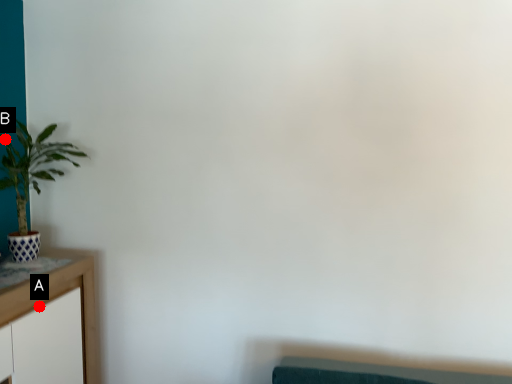
Question: Two points are circled on the image, labeled by A and B beside each circle. Which point is further to the camera?

Choices:
 (A) A is further
 (B) B is further

Answer: (B)